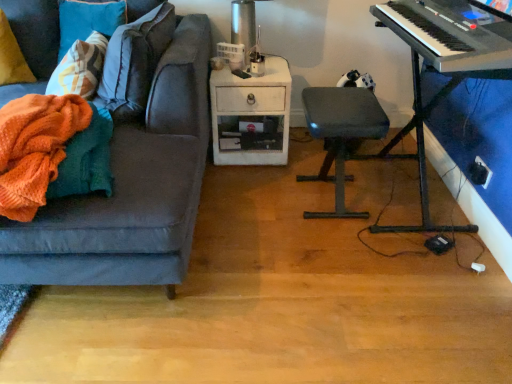
Identify the location of unoccupied area behind matte gray stool at center. (307, 163).